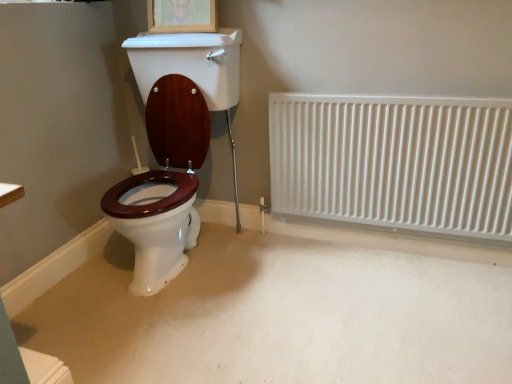
Identify the location of vacant space underneath white metallic radiator at right (from a real-world perspective). The width and height of the screenshot is (512, 384). (358, 241).